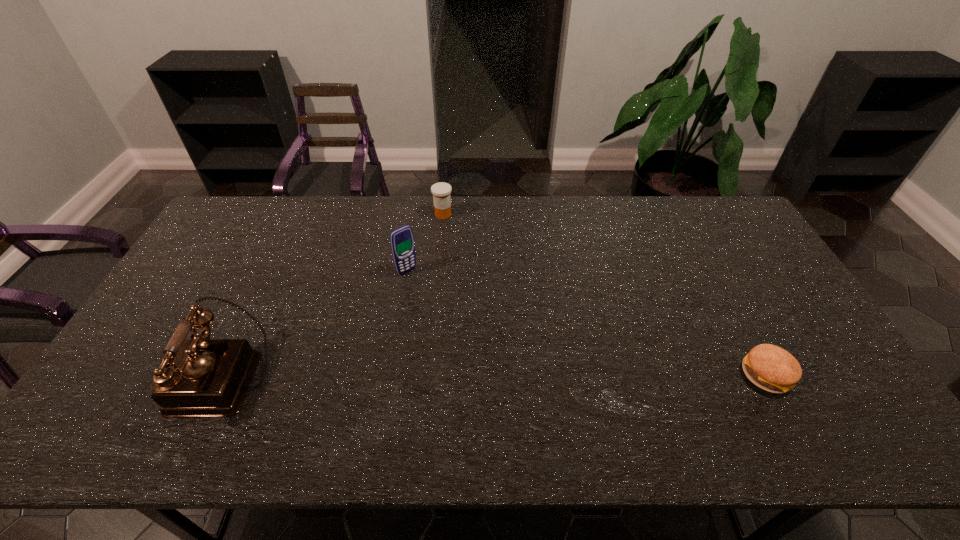
The width and height of the screenshot is (960, 540). Find the location of `telephone`. telephone is located at coordinates (199, 377).

Image resolution: width=960 pixels, height=540 pixels. I want to click on the leftmost object, so click(x=199, y=377).

Where is `the shortest object`? The width and height of the screenshot is (960, 540). the shortest object is located at coordinates (769, 367).

The height and width of the screenshot is (540, 960). What are the coordinates of `hamburger` in the screenshot? It's located at (769, 367).

I want to click on the second shortest object, so click(x=441, y=191).

The height and width of the screenshot is (540, 960). In order to click on medicine in this screenshot , I will do `click(441, 191)`.

This screenshot has width=960, height=540. I want to click on the second object from left to right, so click(402, 241).

Locate an element on the screen. The image size is (960, 540). cellular telephone is located at coordinates (402, 241).

Where is `free space located 0.060m on the dial of the tallest object`? free space located 0.060m on the dial of the tallest object is located at coordinates 151,377.

Where is `vacant space located 0.100m on the dial of the tallest object`? The image size is (960, 540). vacant space located 0.100m on the dial of the tallest object is located at coordinates (134, 377).